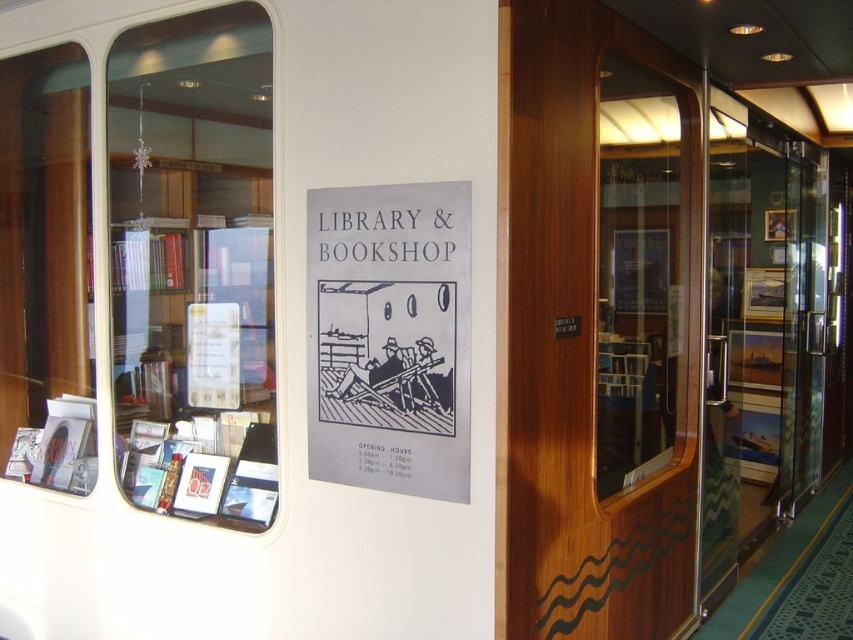
Question: Which point is farther to the camera?

Choices:
 (A) white paper sign at center
 (B) matte plastic book at lower left
 (C) clear glass window at left

Answer: (B)

Question: Among these objects, which one is farthest from the camera?

Choices:
 (A) matte plastic book at lower left
 (B) white paper sign at center

Answer: (A)

Question: Considering the real-world distances, which object is farthest from the matte plastic book at lower left?

Choices:
 (A) wooden door at center
 (B) white paper at center
 (C) transparent glass door at center

Answer: (C)

Question: Does clear glass window at left have a greater width compared to gray paper poster at center?

Choices:
 (A) no
 (B) yes

Answer: (B)

Question: Is transparent glass door at center below matte plastic book at lower left?

Choices:
 (A) no
 (B) yes

Answer: (A)

Question: Does clear glass window at left appear on the left side of matte plastic book at lower left?

Choices:
 (A) no
 (B) yes

Answer: (B)